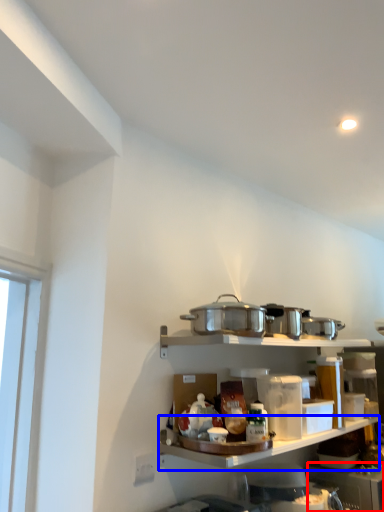
Question: Among these objects, which one is nearest to the camera, appliance (highlighted by a red box) or shelf (highlighted by a blue box)?

Choices:
 (A) appliance
 (B) shelf

Answer: (B)